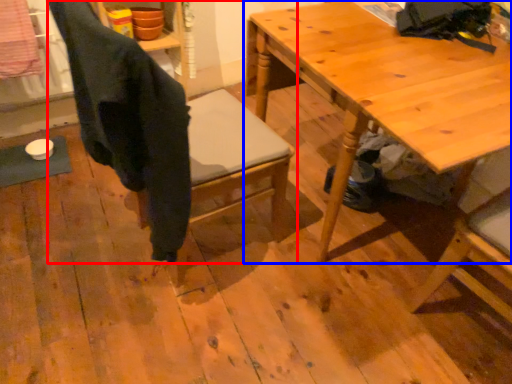
Question: Which object appears farthest to the camera in this image, chair (highlighted by a red box) or table (highlighted by a blue box)?

Choices:
 (A) chair
 (B) table

Answer: (B)